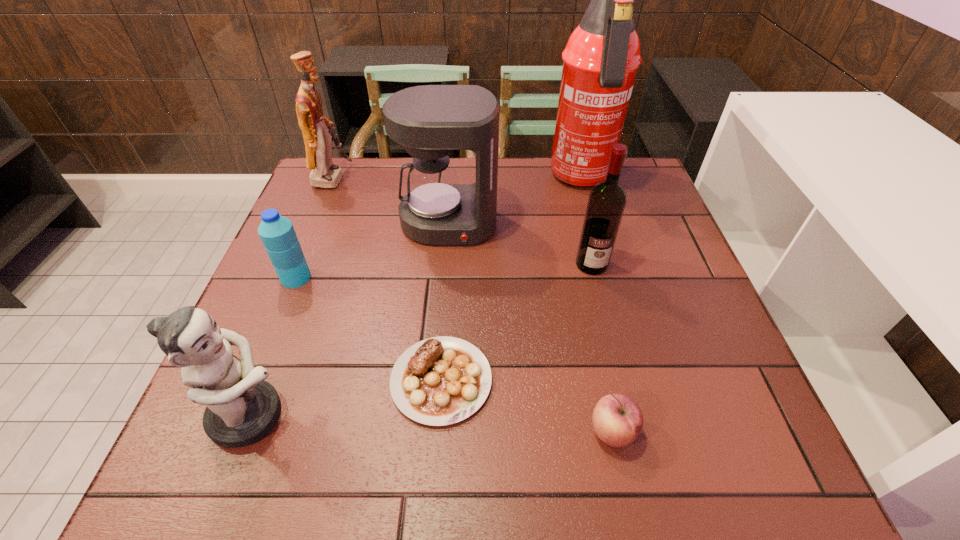
Identify the location of empty location between the sixth tallest object and the figurine. (274, 347).

Locate an element on the screen. The height and width of the screenshot is (540, 960). free space between the fire extinguisher and the coffee maker is located at coordinates (515, 201).

You are a GUI agent. You are given a task and a screenshot of the screen. Output one action in this format:
    pyautogui.click(x=<x>, y=<y>)
    Task: Click on the object that ranks as the closest to the coffee maker
    The height and width of the screenshot is (540, 960).
    Given the screenshot: What is the action you would take?
    pyautogui.click(x=600, y=61)

Locate which object ranks sixth in proximity to the coffee maker. Please provide its 2D coordinates. Your answer should be formatted as a tuple, i.e. [(x, y)], where the tuple contains the x and y coordinates of a point satisfying the conditions above.

[(241, 409)]

Identify the location of vacant position in the image that satisfies the following two spatial constraints: 1. on the back side of the second shortest object; 2. on the front-facing side of the figurine. (609, 415).

Where is `free space that satisfies the following two spatial constraints: 1. on the front and back of the alcohol; 2. on the front-facing side of the figurine`? The image size is (960, 540). free space that satisfies the following two spatial constraints: 1. on the front and back of the alcohol; 2. on the front-facing side of the figurine is located at coordinates (630, 415).

At what (x,y) coordinates should I click in order to perform the action: click on free space that satisfies the following two spatial constraints: 1. on the front-facing side of the steak; 2. on the left side of the nutcracker. Please return your answer as a coordinate pair (x, y). The height and width of the screenshot is (540, 960). Looking at the image, I should click on (248, 380).

Find the location of a particular element. This screenshot has width=960, height=540. vacant position in the image that satisfies the following two spatial constraints: 1. on the button side of the coffee maker; 2. on the left side of the steak is located at coordinates (437, 380).